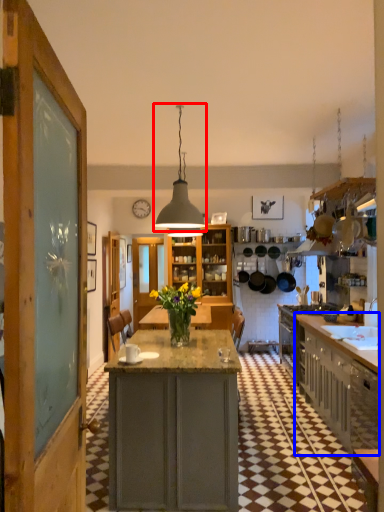
Question: Which of the following is the farthest to the observer, light fixture (highlighted by a red box) or cabinetry (highlighted by a blue box)?

Choices:
 (A) light fixture
 (B) cabinetry

Answer: (B)